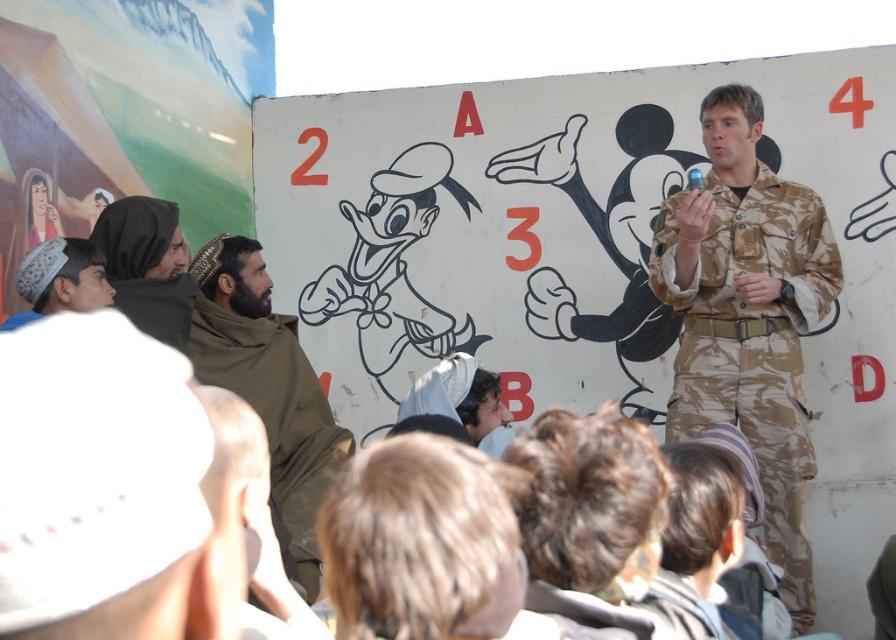
Question: Is camouflage uniform at center bigger than light brown fabric cap at left?

Choices:
 (A) yes
 (B) no

Answer: (A)

Question: Which is nearer to the brown woolen scarf at left?

Choices:
 (A) black woolen scarf at left
 (B) camouflage uniform at center
 (C) light brown fabric cap at left

Answer: (A)

Question: Does camouflage uniform at center come behind brown woolen scarf at left?

Choices:
 (A) no
 (B) yes

Answer: (B)

Question: Considering the real-world distances, which object is farthest from the black woolen scarf at left?

Choices:
 (A) camouflage uniform at center
 (B) light brown fabric cap at left

Answer: (A)

Question: Among these points, which one is nearest to the camera?

Choices:
 (A) (182, 308)
 (B) (108, 289)
 (C) (283, 516)

Answer: (B)

Question: Does camouflage uniform at center have a lesser width compared to light brown fabric cap at left?

Choices:
 (A) no
 (B) yes

Answer: (A)